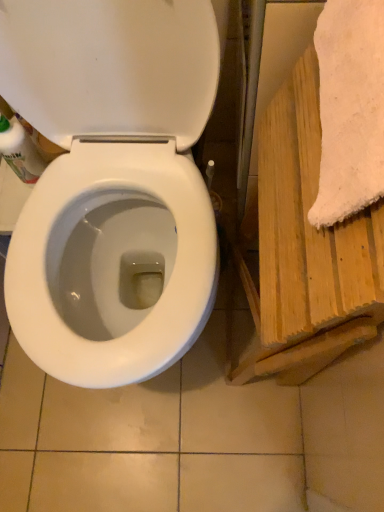
What do you see at coordinates (350, 109) in the screenshot? I see `white fluffy towel at right` at bounding box center [350, 109].

Locate an element on the screen. translucent plastic bottle at left is located at coordinates (20, 151).

The height and width of the screenshot is (512, 384). Find the location of `white glossy toilet at center`. white glossy toilet at center is located at coordinates (111, 263).

From the image's perspective, is white glossy toilet at center under wooden towel at right?

Incorrect, from the image's perspective, white glossy toilet at center is higher than wooden towel at right.

Which is closer, [128,223] or [363,417]?

Point [128,223] is farther from the camera than point [363,417].

Is white glossy toilet at center not within wooden towel at right?

white glossy toilet at center lies outside wooden towel at right's area.

At what (x,y) coordinates should I click in order to perform the action: click on bath towel in front of the wooden towel at right. Please return your answer as a coordinate pair (x, y). Looking at the image, I should click on [x=350, y=109].

Is wooden towel at right not inside white fluffy towel at right?

Yes.

From the picture: From a real-world perspective, relative to white fluffy towel at right, is wooden towel at right vertically above or below?

wooden towel at right is situated lower than white fluffy towel at right in the real world.

Who is shorter, white fluffy towel at right or white glossy toilet at center?

With less height is white fluffy towel at right.

Is white fluffy towel at right to the right of white glossy toilet at center from the viewer's perspective?

Yes.

Is white fluffy towel at right beside white glossy toilet at center?

No.

Is the position of white fluffy towel at right less distant than that of white glossy toilet at center?

No, white fluffy towel at right is further to the viewer.

Is the depth of translucent plastic bottle at left greater than that of white glossy toilet at center?

Yes, translucent plastic bottle at left is behind white glossy toilet at center.

Looking at their sizes, would you say translucent plastic bottle at left is wider or thinner than white glossy toilet at center?

Considering their sizes, translucent plastic bottle at left looks slimmer than white glossy toilet at center.

Can you confirm if translucent plastic bottle at left is bigger than white glossy toilet at center?

No.

The image size is (384, 512). Identify the location of cleaning product above the white glossy toilet at center (from the image's perspective). (20, 151).

Is point (116, 244) positioned in front of point (26, 148)?

No.

Is white glossy toilet at center bigger than translucent plastic bottle at left?

Yes, white glossy toilet at center is bigger than translucent plastic bottle at left.

Is white glossy toilet at center turned away from translucent plastic bottle at left?

No, white glossy toilet at center is not facing the opposite direction of translucent plastic bottle at left.

Where is `bidet below the white fluffy towel at right (from the image's perspective)`? Image resolution: width=384 pixels, height=512 pixels. bidet below the white fluffy towel at right (from the image's perspective) is located at coordinates (111, 263).

Is white fluffy towel at right a part of white glossy toilet at center?

No.

Is white glossy toilet at center thinner than white fluffy towel at right?

No, white glossy toilet at center is not thinner than white fluffy towel at right.

Is white glossy toilet at center looking in the opposite direction of white fluffy towel at right?

No, white glossy toilet at center is not facing the opposite direction of white fluffy towel at right.

In terms of size, does white fluffy towel at right appear bigger or smaller than wooden towel at right?

white fluffy towel at right is smaller than wooden towel at right.

In the scene shown: Considering the sizes of objects white fluffy towel at right and wooden towel at right in the image provided, who is taller, white fluffy towel at right or wooden towel at right?

Standing taller between the two is wooden towel at right.

Is wooden towel at right located within white fluffy towel at right?

Actually, wooden towel at right is outside white fluffy towel at right.

Is white fluffy towel at right not near wooden towel at right?

white fluffy towel at right is actually quite close to wooden towel at right.

Where is `tile lying behind the white glossy toilet at center`? tile lying behind the white glossy toilet at center is located at coordinates (346, 404).

The height and width of the screenshot is (512, 384). I want to click on bath towel in front of the wooden towel at right, so (350, 109).

Considering their positions, is wooden towel at right positioned further to white glossy toilet at center than white fluffy towel at right?

white fluffy towel at right is further to white glossy toilet at center.

When comparing their distances from white glossy toilet at center, does wooden towel at right or translucent plastic bottle at left seem closer?

Based on the image, translucent plastic bottle at left appears to be nearer to white glossy toilet at center.

Looking at the image, which one is located further to translucent plastic bottle at left, wooden towel at right or white fluffy towel at right?

Among the two, wooden towel at right is located further to translucent plastic bottle at left.

Considering their positions, is white glossy toilet at center positioned further to translucent plastic bottle at left than white fluffy towel at right?

white fluffy towel at right is positioned further to the anchor translucent plastic bottle at left.

Considering their positions, is white glossy toilet at center positioned further to white fluffy towel at right than wooden towel at right?

white glossy toilet at center lies further to white fluffy towel at right than the other object.

Considering their positions, is translucent plastic bottle at left positioned closer to wooden towel at right than white glossy toilet at center?

Among the two, white glossy toilet at center is located nearer to wooden towel at right.

When comparing their distances from white glossy toilet at center, does translucent plastic bottle at left or wooden towel at right seem further?

wooden towel at right.

Estimate the real-world distances between objects in this image. Which object is further from translucent plastic bottle at left, white glossy toilet at center or wooden towel at right?

wooden towel at right is positioned further to the anchor translucent plastic bottle at left.

This screenshot has width=384, height=512. I want to click on bath towel between white glossy toilet at center and translucent plastic bottle at left from front to back, so click(350, 109).

This screenshot has width=384, height=512. I want to click on bidet between translucent plastic bottle at left and wooden towel at right from left to right, so click(111, 263).

At what (x,y) coordinates should I click in order to perform the action: click on bath towel between translucent plastic bottle at left and wooden towel at right. Please return your answer as a coordinate pair (x, y). Looking at the image, I should click on (350, 109).

Where is `bidet between white fluffy towel at right and wooden towel at right vertically`? bidet between white fluffy towel at right and wooden towel at right vertically is located at coordinates (111, 263).